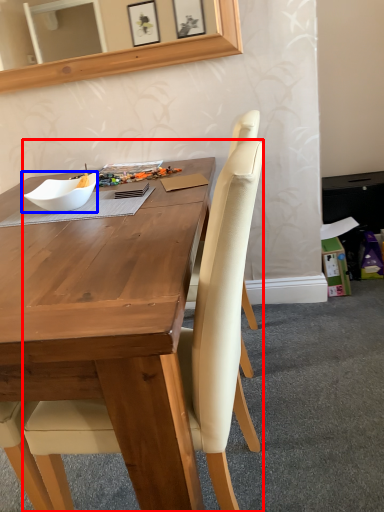
Question: Which object appears farthest to the camera in this image, chair (highlighted by a red box) or bowl (highlighted by a blue box)?

Choices:
 (A) chair
 (B) bowl

Answer: (B)